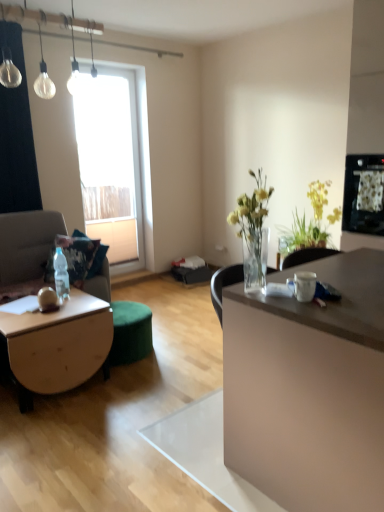
Question: Does point (69, 82) appear closer or farther from the camera than point (307, 228)?

Choices:
 (A) closer
 (B) farther

Answer: (B)

Question: Considering the relative positions of clear glass light bulb at upper left and yellow-green leafy plant at upper right in the image provided, is clear glass light bulb at upper left to the left or to the right of yellow-green leafy plant at upper right?

Choices:
 (A) right
 (B) left

Answer: (B)

Question: Estimate the real-world distances between objects in this image. Which object is farther from the matte white desk at right?

Choices:
 (A) clear plastic bottle at lower left
 (B) transparent glass window at upper left
 (C) clear glass light bulb at upper left
 (D) matte beige couch at left
 (E) white glossy mug at center

Answer: (B)

Question: Estimate the real-world distances between objects in this image. Which object is farther from the yellow-green leafy plant at upper right?

Choices:
 (A) wooden coffee table at lower left
 (B) matte white desk at right
 (C) transparent glass window at upper left
 (D) matte beige couch at left
 (E) clear plastic bottle at lower left

Answer: (D)